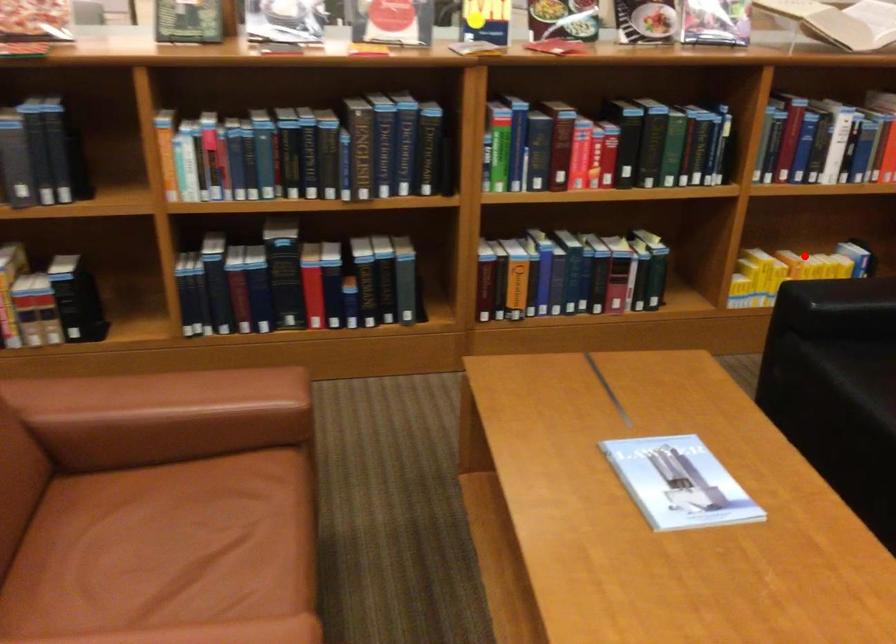
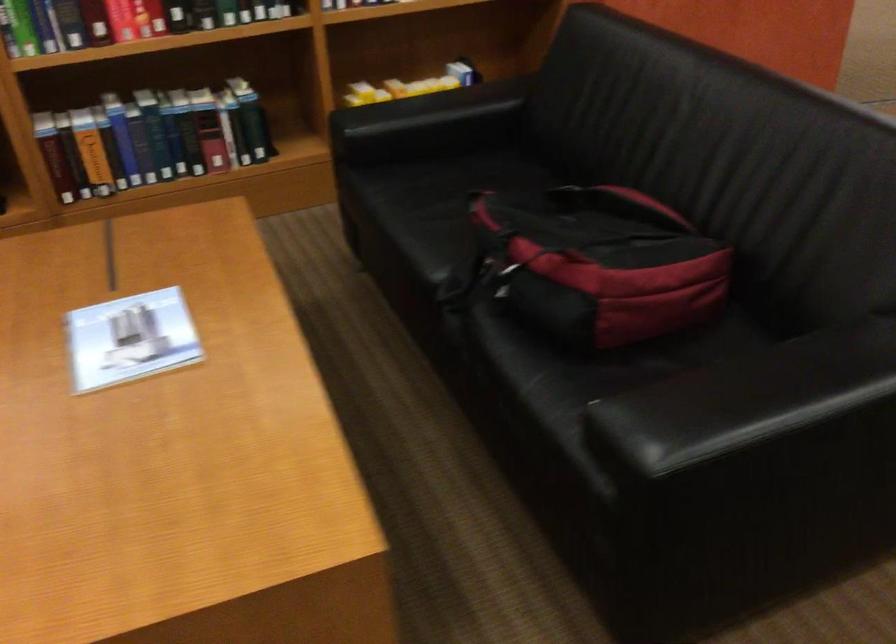
In the second image, find the point that corresponds to the highlighted location in the first image.

(410, 86)